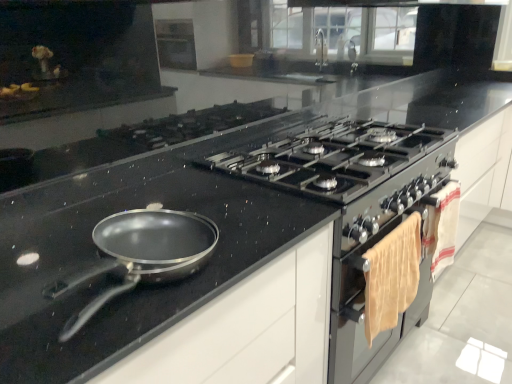
Question: From their relative heights in the image, would you say white cotton towel at right is taller or shorter than matte black countertop at center?

Choices:
 (A) short
 (B) tall

Answer: (A)

Question: In terms of width, does white cotton towel at right look wider or thinner when compared to matte black countertop at center?

Choices:
 (A) thin
 (B) wide

Answer: (A)

Question: Which is farther from the white cotton towel at right?

Choices:
 (A) black glass gas stove at center
 (B) matte silver oven at right
 (C) matte black countertop at center

Answer: (C)

Question: Which object is the closest to the matte black countertop at center?

Choices:
 (A) white cotton towel at right
 (B) matte silver oven at right
 (C) black glass gas stove at center

Answer: (B)